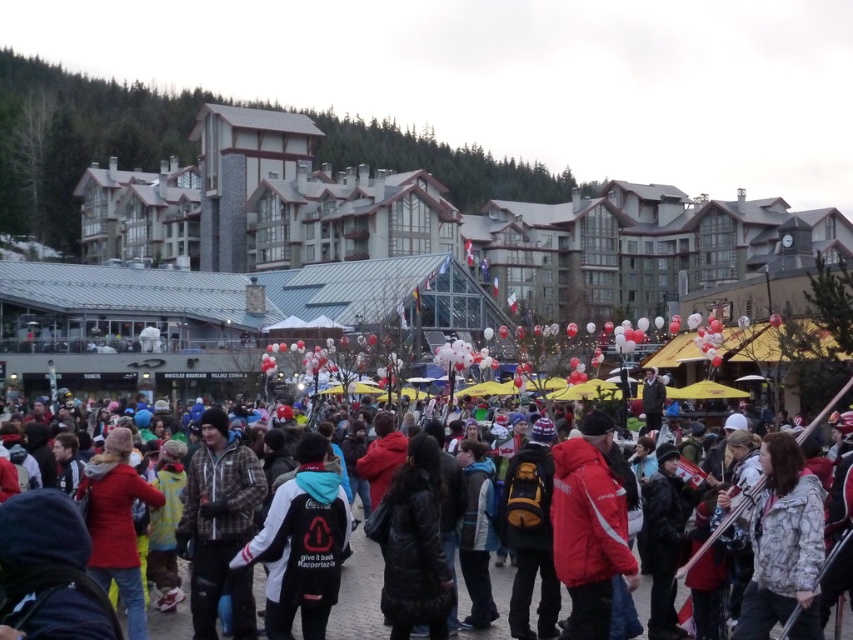
You are standing at the point marked as point [300,545] in the image. What object is exactly at that point?

The black fleece jacket at center is exactly at point 0.854, 0.354.

You are standing at the center of the crowd in the image. Which direction should you move to locate the black fleece jacket at center?

Since the black fleece jacket at center is located at point coordinates of (300,545), you should move towards the center of the crowd to find it.